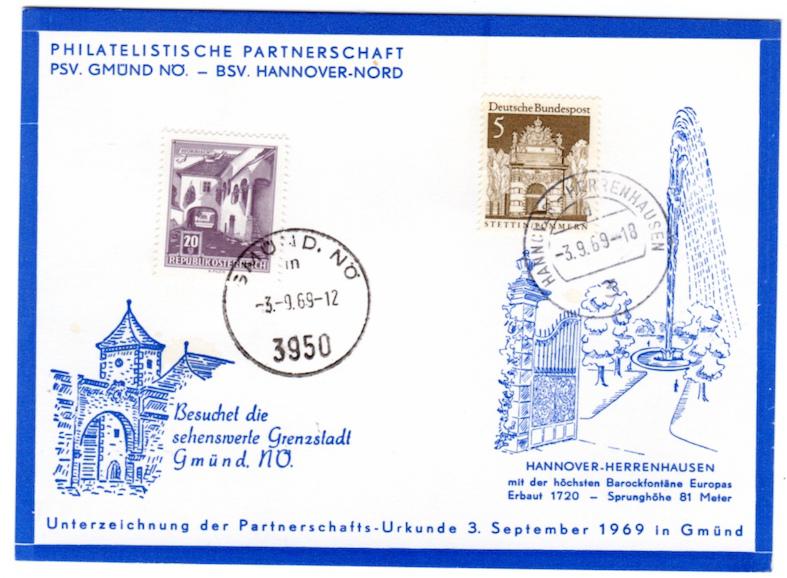
Image resolution: width=787 pixels, height=578 pixels. In order to click on archway in this screenshot , I will do `click(131, 440)`.